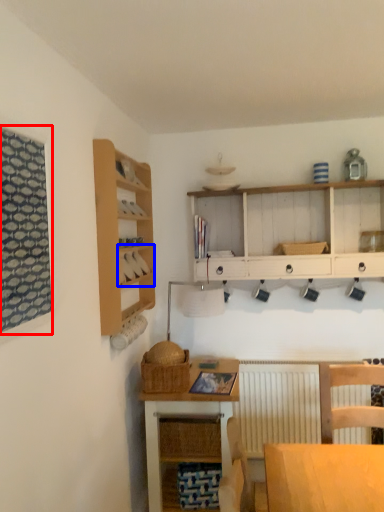
Question: Which of the following is the farthest to the observer, window (highlighted by a red box) or cabinet (highlighted by a blue box)?

Choices:
 (A) window
 (B) cabinet

Answer: (B)